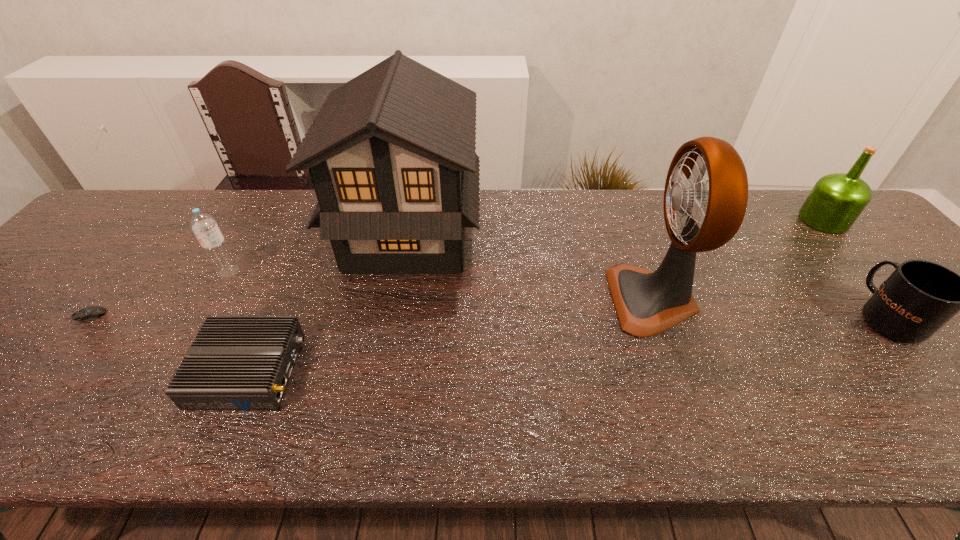
Where is `dollhouse`? dollhouse is located at coordinates (391, 154).

I want to click on the third object from right to left, so click(647, 303).

You are a GUI agent. You are given a task and a screenshot of the screen. Output one action in this format:
    pyautogui.click(x=<x>, y=<y>)
    Task: Click on the olive oil
    The image size is (960, 540).
    Given the screenshot: What is the action you would take?
    pyautogui.click(x=835, y=202)

This screenshot has width=960, height=540. What are the coordinates of `water bottle` in the screenshot? It's located at (204, 226).

Locate an element on the screen. The image size is (960, 540). the fourth tallest object is located at coordinates (204, 226).

Identify the location of mug. click(x=919, y=297).

Locate an element on the screen. The image size is (960, 540). router is located at coordinates (235, 362).

This screenshot has height=540, width=960. I want to click on the shortest object, so click(x=89, y=313).

Locate an element on the screen. The image size is (960, 540). computer mouse is located at coordinates (89, 313).

You are a GUI agent. You are given a task and a screenshot of the screen. Output one action in this format:
    pyautogui.click(x=<x>, y=<y>)
    Task: Click on the vacant space located 0.080m on the front-facing side of the dollhouse
    The height and width of the screenshot is (540, 960).
    Given the screenshot: What is the action you would take?
    pyautogui.click(x=509, y=234)